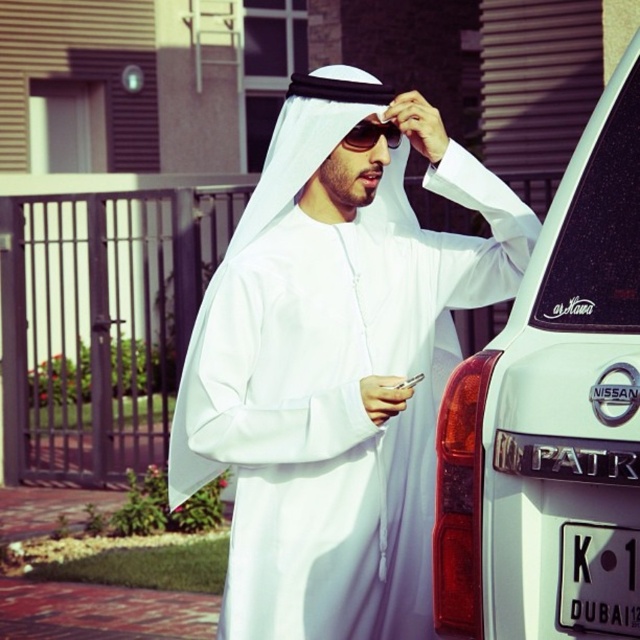
Question: Which point is farther from the camera taking this photo?

Choices:
 (A) (196, 416)
 (B) (465, 449)
 (C) (628, 598)

Answer: (A)

Question: Is white matte kandura at center to the right of white matte nissan patrol at right from the viewer's perspective?

Choices:
 (A) no
 (B) yes

Answer: (A)

Question: Can you confirm if black plastic license plate at lower right is positioned above black reflective sunglasses at upper center?

Choices:
 (A) yes
 (B) no

Answer: (B)

Question: Which point is closer to the camera?

Choices:
 (A) black plastic license plate at lower right
 (B) white matte nissan patrol at right
 (C) white matte kandura at center

Answer: (B)

Question: Which point is farther from the camera taking this photo?

Choices:
 (A) (346, 141)
 (B) (483, 493)

Answer: (A)

Question: Can you confirm if white matte kandura at center is positioned to the right of black plastic license plate at lower right?

Choices:
 (A) no
 (B) yes

Answer: (A)